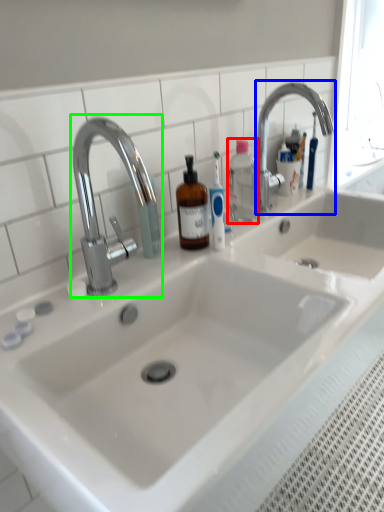
Question: Estimate the real-world distances between objects in this image. Which object is closer to bottle (highlighted by a red box), tap (highlighted by a blue box) or tap (highlighted by a green box)?

Choices:
 (A) tap
 (B) tap

Answer: (A)